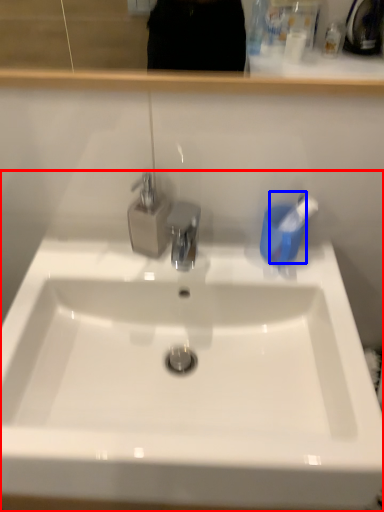
Question: Which of the following is the closest to the observer, sink (highlighted by a red box) or toothbrush (highlighted by a blue box)?

Choices:
 (A) sink
 (B) toothbrush

Answer: (A)